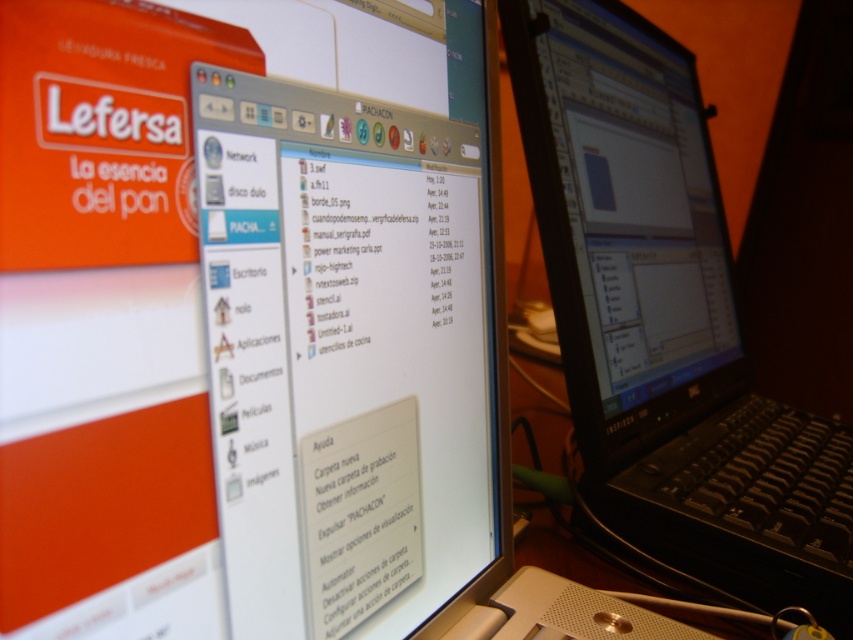
Can you confirm if black plastic laptop at center is positioned above matte black monitor at center?

No, black plastic laptop at center is not above matte black monitor at center.

Identify the location of black plastic laptop at center. click(666, 320).

The width and height of the screenshot is (853, 640). Find the location of `black plastic laptop at center`. black plastic laptop at center is located at coordinates (666, 320).